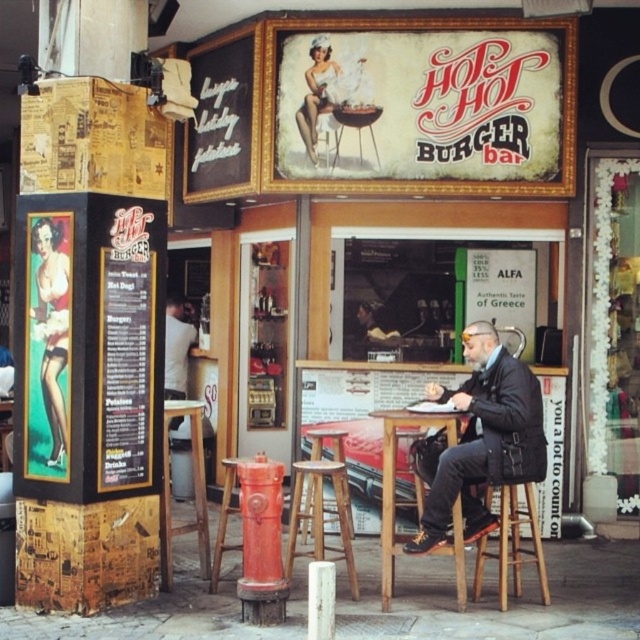
Question: In this image, where is vintage cardboard sign at upper center located relative to metallic red fire hydrant at center?

Choices:
 (A) below
 (B) above

Answer: (B)

Question: Considering the relative positions of vintage cardboard sign at upper center and metallic red fire hydrant at center in the image provided, where is vintage cardboard sign at upper center located with respect to metallic red fire hydrant at center?

Choices:
 (A) right
 (B) left

Answer: (A)

Question: Which point is farther to the camera?

Choices:
 (A) wooden table at lower center
 (B) black leather jacket at center
 (C) metallic red fire hydrant at center

Answer: (A)

Question: Is wooden bar stool at lower center positioned in front of metallic red fire hydrant at center?

Choices:
 (A) no
 (B) yes

Answer: (B)

Question: Which point is farther to the camera?

Choices:
 (A) wooden table at lower center
 (B) black leather jacket at center

Answer: (A)

Question: Which object is farther from the camera taking this photo?

Choices:
 (A) vintage cardboard sign at upper center
 (B) wooden table at center
 (C) wooden table at lower center
 (D) dark brown leather jacket at center

Answer: (D)